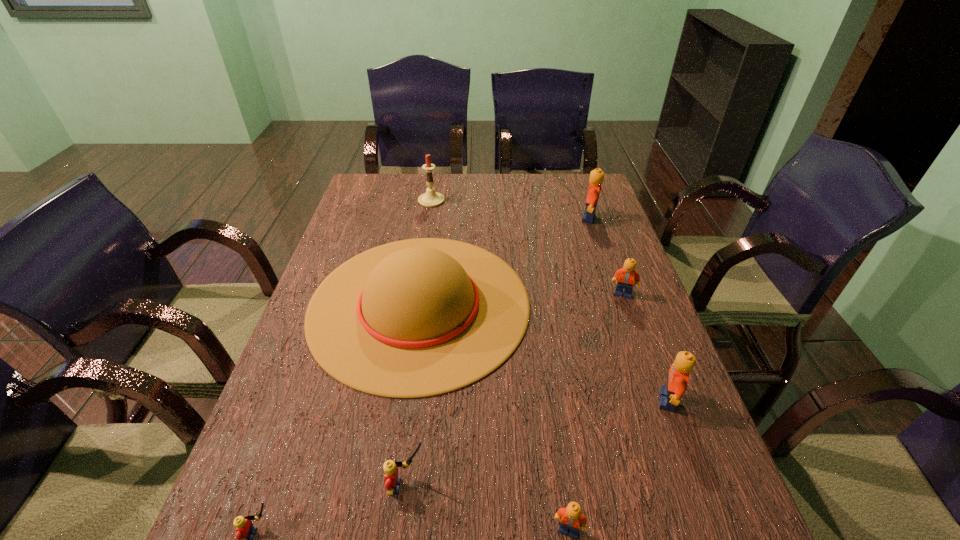
The height and width of the screenshot is (540, 960). What are the coordinates of `free spot between the leftmost orange Lego and the sombrero` in the screenshot? It's located at (494, 417).

Find the location of `free space between the third smallest orange Lego and the leftmost orange Lego`. free space between the third smallest orange Lego and the leftmost orange Lego is located at coordinates (618, 464).

Find the location of a particular element. The width and height of the screenshot is (960, 540). vacant region between the red candle and the fourth nearest Lego is located at coordinates (549, 300).

Find the location of a particular element. The width and height of the screenshot is (960, 540). empty location between the second smallest orange Lego and the second farthest object is located at coordinates (606, 256).

In order to click on vacant point located between the red candle and the third farthest Lego in this screenshot , I will do `click(549, 300)`.

Where is `free space that is in between the sombrero and the leftmost orange Lego`? This screenshot has height=540, width=960. free space that is in between the sombrero and the leftmost orange Lego is located at coordinates (494, 417).

Identify which object is the closest to the fourth Lego from right to left. Please provide its 2D coordinates. Your answer should be formatted as a tuple, i.e. [(x, y)], where the tuple contains the x and y coordinates of a point satisfying the conditions above.

[(392, 484)]

Find the location of `object that can be found as the sixth closest to the biggest orange Lego`. object that can be found as the sixth closest to the biggest orange Lego is located at coordinates (392, 484).

Find the location of a particular element. The height and width of the screenshot is (540, 960). Lego that is the third closest to the left yellow Lego is located at coordinates (678, 376).

Locate which Lego ranks fourth in proximity to the sombrero. Please provide its 2D coordinates. Your answer should be formatted as a tuple, i.e. [(x, y)], where the tuple contains the x and y coordinates of a point satisfying the conditions above.

[(572, 518)]